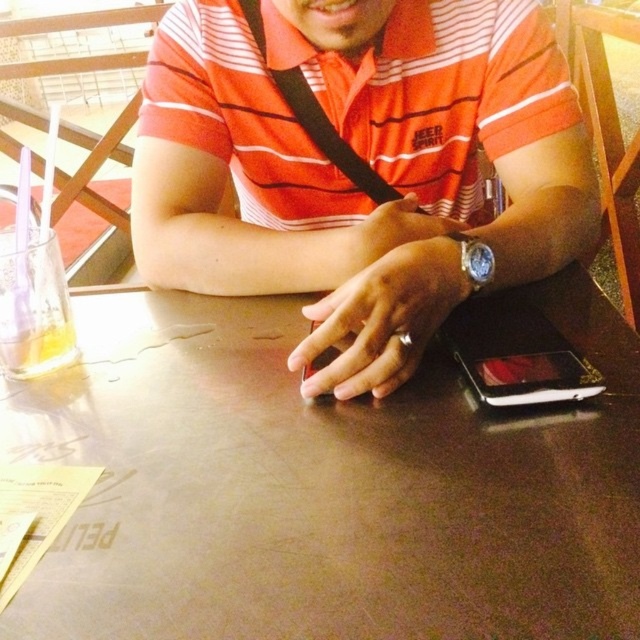
Question: Which object is the farthest from the matte black phone at center?

Choices:
 (A) black plastic phone at lower right
 (B) metallic brown table at center
 (C) black matte smartphone at center

Answer: (C)

Question: Is matte black phone at center above black matte smartphone at center?

Choices:
 (A) yes
 (B) no

Answer: (A)

Question: Does matte black phone at center have a smaller size compared to black plastic phone at lower right?

Choices:
 (A) yes
 (B) no

Answer: (B)

Question: Which point is closer to the camera taking this photo?

Choices:
 (A) (308, 328)
 (B) (572, 208)
 (C) (532, 396)
 (D) (4, 385)

Answer: (C)

Question: Which of these objects is positioned closest to the black matte smartphone at center?

Choices:
 (A) black plastic phone at lower right
 (B) metallic brown table at center
 (C) matte black phone at center

Answer: (A)

Question: Is metallic brown table at center to the left of black plastic phone at lower right from the viewer's perspective?

Choices:
 (A) no
 (B) yes

Answer: (B)